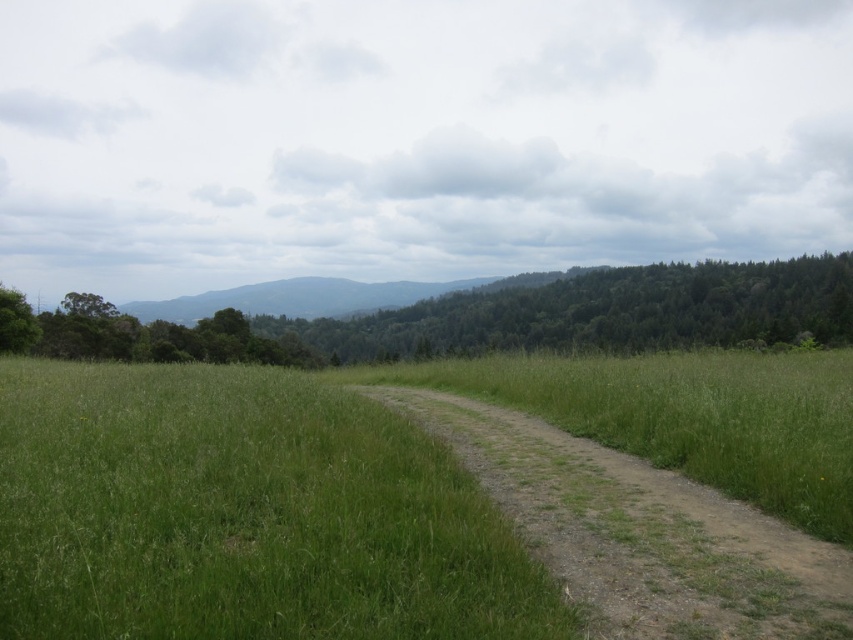
Does dirt/gravel path at center have a larger size compared to green leafy trees at upper center?

No, dirt/gravel path at center is not bigger than green leafy trees at upper center.

Image resolution: width=853 pixels, height=640 pixels. What do you see at coordinates (640, 531) in the screenshot?
I see `dirt/gravel path at center` at bounding box center [640, 531].

You are a GUI agent. You are given a task and a screenshot of the screen. Output one action in this format:
    pyautogui.click(x=<x>, y=<y>)
    Task: Click on the dirt/gravel path at center
    The width and height of the screenshot is (853, 640).
    Given the screenshot: What is the action you would take?
    pyautogui.click(x=640, y=531)